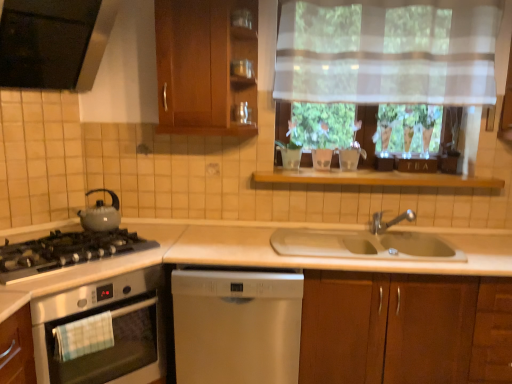
In order to click on free space above wooden shelf at center (from a real-world perspective) in this screenshot , I will do `click(389, 171)`.